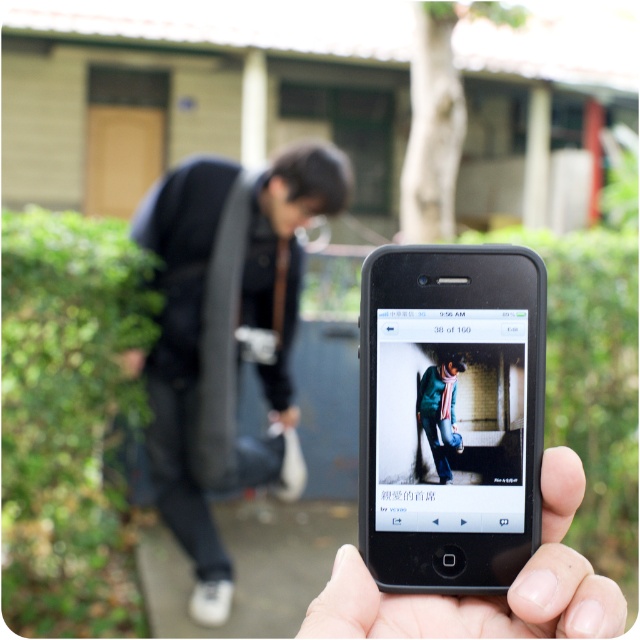
Question: Can you confirm if black plastic smartphone at center is wider than black matte phone at lower center?

Choices:
 (A) no
 (B) yes

Answer: (A)

Question: Which point is closer to the camera?

Choices:
 (A) (211, 176)
 (B) (451, 413)
 (C) (410, 250)
 (D) (381, 609)

Answer: (D)

Question: Is black plastic smartphone at center behind black fabric bag at left?

Choices:
 (A) yes
 (B) no

Answer: (B)

Question: Can you confirm if black matte phone at lower center is positioned below green woolen sweater at center?

Choices:
 (A) no
 (B) yes

Answer: (B)

Question: Which of the following is the farthest from the observer?

Choices:
 (A) (440, 397)
 (B) (502, 349)
 (C) (444, 620)

Answer: (A)

Question: Which object is farther from the camera taking this photo?

Choices:
 (A) black plastic smartphone at center
 (B) green woolen sweater at center
 (C) black matte phone at lower center
 (D) black fabric bag at left

Answer: (D)